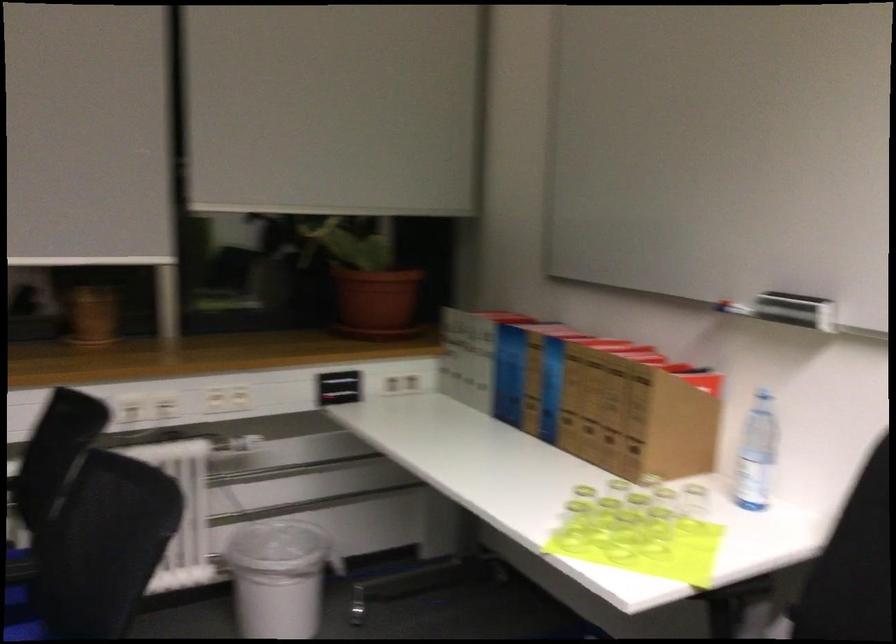
Identify the location of black rocker switch. (x=339, y=386).